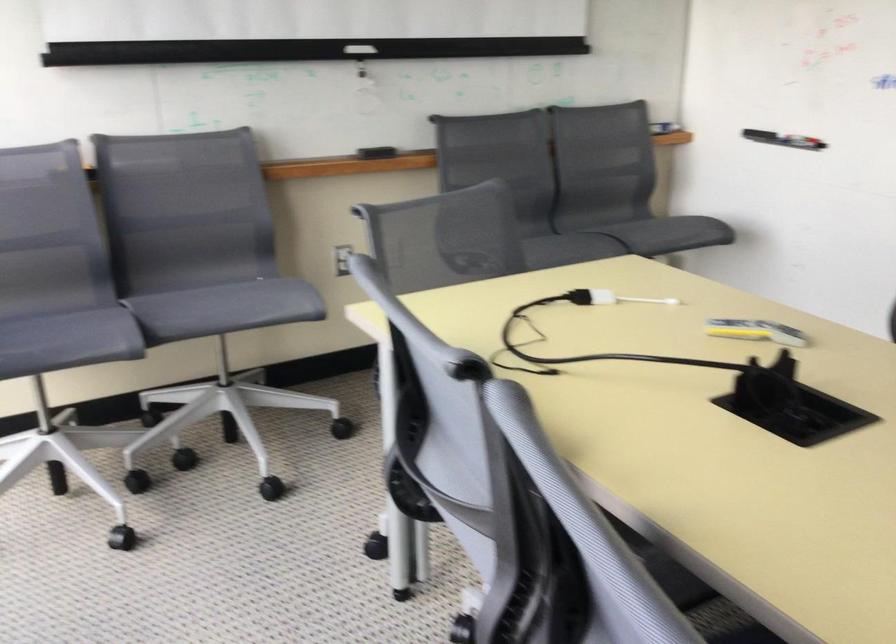
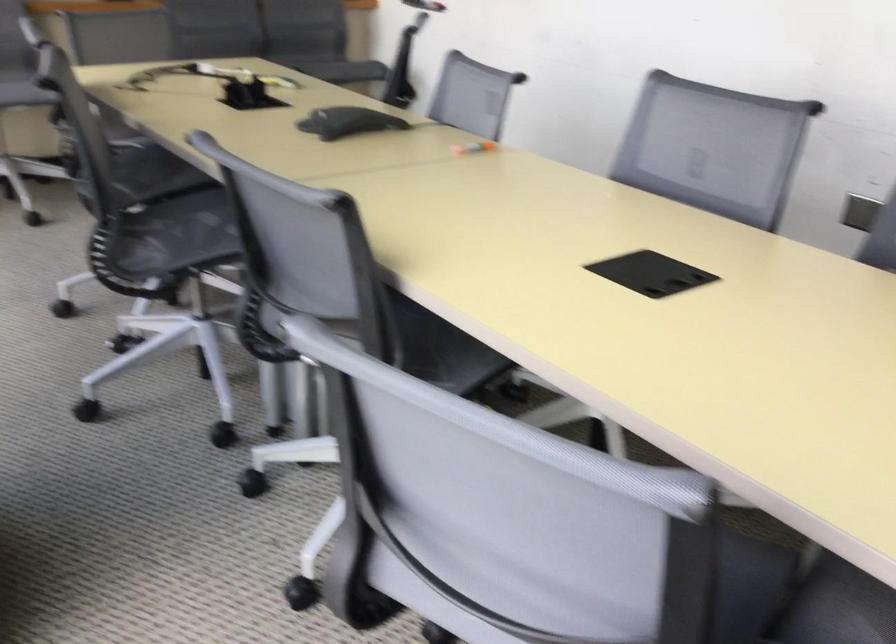
Question: I am providing you with two images of the same scene from different viewpoints. Please identify which objects are invisible in image2.

Choices:
 (A) gray chair armrest
 (B) chair sitting surface
 (C) black conference phone
 (D) grey metal pole

Answer: (B)